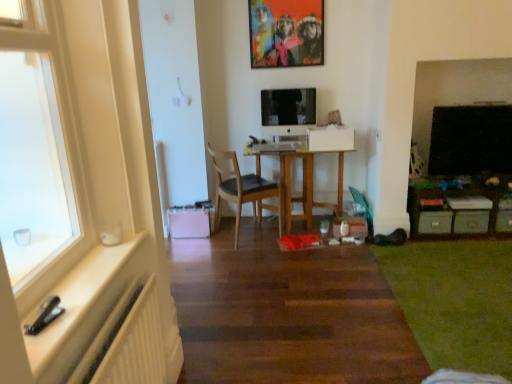
Question: Is point (x=18, y=178) closer or farther from the camera than point (x=415, y=269)?

Choices:
 (A) closer
 (B) farther

Answer: (A)

Question: Would you say white glossy window sill at left is to the left or to the right of green carpet at lower right in the picture?

Choices:
 (A) left
 (B) right

Answer: (A)

Question: Which object is positioned farthest from the white ribbed radiator at lower left?

Choices:
 (A) wooden chair at center
 (B) green matte drawer at lower right, the first drawer from the left
 (C) green matte drawer at lower right, which is the 1th drawer in right-to-left order
 (D) metallic green storage at right
 (E) acrylic painting at upper center

Answer: (C)

Question: Which object is the closest to the acrylic painting at upper center?

Choices:
 (A) green matte drawer at lower right, placed as the second drawer when sorted from left to right
 (B) white ribbed radiator at lower left
 (C) black glossy tv at right
 (D) wooden desk at center
 (E) metallic green storage at right

Answer: (D)